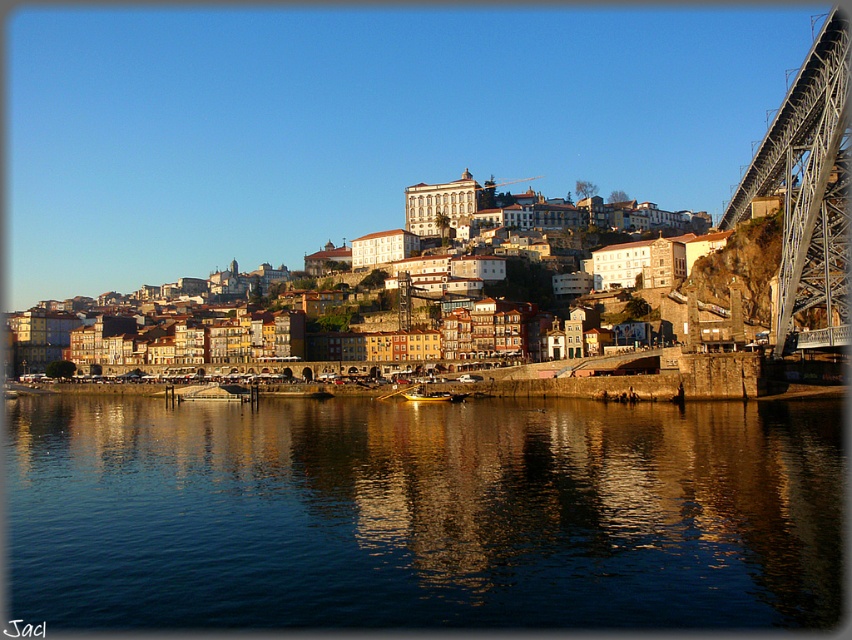
Question: Is dark blue water at lower center wider than multicolored stone buildings at center?

Choices:
 (A) no
 (B) yes

Answer: (A)

Question: Can you confirm if dark blue water at lower center is positioned to the left of metallic steel bridge at right?

Choices:
 (A) yes
 (B) no

Answer: (A)

Question: Observing the image, what is the correct spatial positioning of multicolored stone buildings at center in reference to metallic steel bridge at right?

Choices:
 (A) left
 (B) right

Answer: (A)

Question: Estimate the real-world distances between objects in this image. Which object is closer to the dark blue water at lower center?

Choices:
 (A) multicolored stone buildings at center
 (B) metallic steel bridge at right

Answer: (B)

Question: Which point is closer to the camera?

Choices:
 (A) (838, 237)
 (B) (484, 186)

Answer: (A)

Question: Considering the real-world distances, which object is closest to the dark blue water at lower center?

Choices:
 (A) multicolored stone buildings at center
 (B) metallic steel bridge at right

Answer: (B)